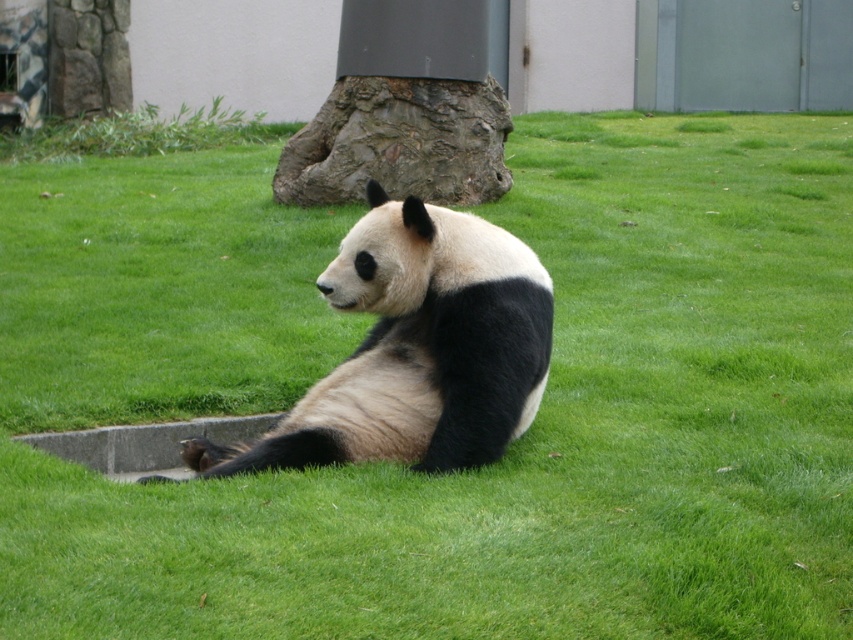
Is point (402, 316) positioned behind point (370, 51)?

That is False.

Locate an element on the screen. This screenshot has width=853, height=640. black fur panda at center is located at coordinates (416, 349).

Is point (437, 346) farther from viewer compared to point (364, 108)?

No, (437, 346) is closer to viewer.

At what (x,y) coordinates should I click in order to perform the action: click on black fur panda at center. Please return your answer as a coordinate pair (x, y). Looking at the image, I should click on pos(416,349).